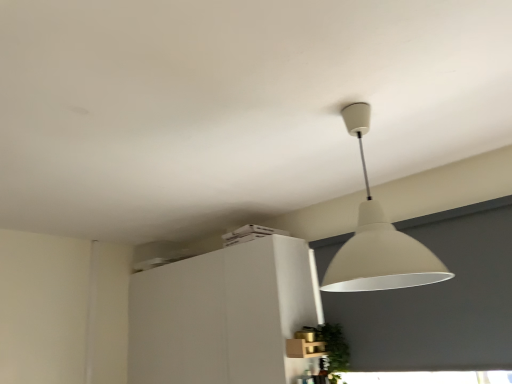
At what (x,y) coordinates should I click in order to perform the action: click on green leafy plant at lower right. Please return your answer as a coordinate pair (x, y). The width and height of the screenshot is (512, 384). Looking at the image, I should click on (334, 349).

In the scene shown: Measure the distance between white matte cabinet at upper center and camera.

The distance of white matte cabinet at upper center from camera is 6.71 feet.

Describe the element at coordinates (378, 240) in the screenshot. Image resolution: width=512 pixels, height=384 pixels. I see `matte white lampshade at upper center` at that location.

The height and width of the screenshot is (384, 512). Find the location of `green leafy plant at lower right`. green leafy plant at lower right is located at coordinates (334, 349).

Is green leafy plant at lower right bigger or smaller than white matte cabinet at upper center?

In the image, green leafy plant at lower right appears to be smaller than white matte cabinet at upper center.

From a real-world perspective, is green leafy plant at lower right beneath white matte cabinet at upper center?

Indeed, from a real-world perspective, green leafy plant at lower right is positioned beneath white matte cabinet at upper center.

How many degrees apart are the facing directions of green leafy plant at lower right and white matte cabinet at upper center?

The angle between the facing direction of green leafy plant at lower right and the facing direction of white matte cabinet at upper center is 90 degrees.

Visually, is green leafy plant at lower right positioned to the left or to the right of white matte cabinet at upper center?

In the image, green leafy plant at lower right appears on the right side of white matte cabinet at upper center.

Is matte white lampshade at upper center far away from white matte cabinet at upper center?

Yes, matte white lampshade at upper center is far from white matte cabinet at upper center.

From a real-world perspective, is matte white lampshade at upper center above or below white matte cabinet at upper center?

From a real-world perspective, matte white lampshade at upper center is physically above white matte cabinet at upper center.

From the picture: Which object is closer to the camera taking this photo, matte white lampshade at upper center or white matte cabinet at upper center?

Positioned in front is matte white lampshade at upper center.

Based on their sizes in the image, would you say matte white lampshade at upper center is bigger or smaller than white matte cabinet at upper center?

Considering their sizes, matte white lampshade at upper center takes up less space than white matte cabinet at upper center.

Would you say matte white lampshade at upper center is inside or outside green leafy plant at lower right?

matte white lampshade at upper center is not inside green leafy plant at lower right, it's outside.

Who is taller, matte white lampshade at upper center or green leafy plant at lower right?

matte white lampshade at upper center.

How much distance is there between matte white lampshade at upper center and green leafy plant at lower right?

matte white lampshade at upper center is 97.23 centimeters away from green leafy plant at lower right.

From the image's perspective, who appears lower, white matte cabinet at upper center or matte white lampshade at upper center?

white matte cabinet at upper center appears lower in the image.

Which object is positioned more to the right, white matte cabinet at upper center or matte white lampshade at upper center?

matte white lampshade at upper center is more to the right.

Would you say white matte cabinet at upper center is outside matte white lampshade at upper center?

That's correct, white matte cabinet at upper center is outside of matte white lampshade at upper center.

Does point (316, 284) lie behind point (400, 265)?

Yes, point (316, 284) is farther from viewer.

Does white matte cabinet at upper center come in front of green leafy plant at lower right?

That is False.

From a real-world perspective, which object stands above the other?

From a 3D spatial view, white matte cabinet at upper center is above.

Does white matte cabinet at upper center have a greater height compared to green leafy plant at lower right?

Yes, white matte cabinet at upper center is taller than green leafy plant at lower right.

From the image's perspective, is white matte cabinet at upper center beneath green leafy plant at lower right?

Yes.

In the scene shown: From a real-world perspective, relative to matte white lampshade at upper center, is green leafy plant at lower right vertically above or below?

green leafy plant at lower right is situated lower than matte white lampshade at upper center in the real world.

Considering the positions of points (328, 344) and (371, 245), is point (328, 344) closer to camera compared to point (371, 245)?

No, (328, 344) is further to viewer.

Can you tell me how much green leafy plant at lower right and matte white lampshade at upper center differ in facing direction?

0.966 degrees.

Is green leafy plant at lower right aimed at matte white lampshade at upper center?

No, green leafy plant at lower right does not turn towards matte white lampshade at upper center.

You are a GUI agent. You are given a task and a screenshot of the screen. Output one action in this format:
    pyautogui.click(x=<x>, y=<y>)
    Task: Click on the cabinetry behind the green leafy plant at lower right
    The image size is (512, 384).
    Given the screenshot: What is the action you would take?
    pyautogui.click(x=224, y=315)

What are the coordinates of `cabinetry below the matte white lampshade at upper center (from a real-world perspective)` in the screenshot? It's located at (224, 315).

Considering their positions, is green leafy plant at lower right positioned further to matte white lampshade at upper center than white matte cabinet at upper center?

white matte cabinet at upper center.

Based on their spatial positions, is green leafy plant at lower right or matte white lampshade at upper center further from white matte cabinet at upper center?

Based on the image, matte white lampshade at upper center appears to be further to white matte cabinet at upper center.

Considering their positions, is matte white lampshade at upper center positioned closer to white matte cabinet at upper center than green leafy plant at lower right?

green leafy plant at lower right is positioned closer to the anchor white matte cabinet at upper center.

Based on their spatial positions, is white matte cabinet at upper center or matte white lampshade at upper center closer to green leafy plant at lower right?

Among the two, white matte cabinet at upper center is located nearer to green leafy plant at lower right.

Which object lies nearer to the anchor point matte white lampshade at upper center, white matte cabinet at upper center or green leafy plant at lower right?

green leafy plant at lower right lies closer to matte white lampshade at upper center than the other object.

Which object lies nearer to the anchor point green leafy plant at lower right, matte white lampshade at upper center or white matte cabinet at upper center?

white matte cabinet at upper center is positioned closer to the anchor green leafy plant at lower right.

Where is `plant located between matte white lampshade at upper center and white matte cabinet at upper center in the depth direction`? The image size is (512, 384). plant located between matte white lampshade at upper center and white matte cabinet at upper center in the depth direction is located at coordinates (334, 349).